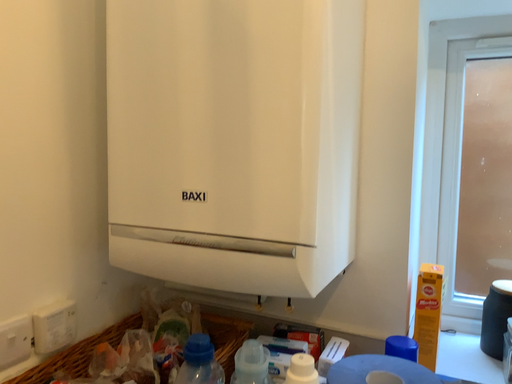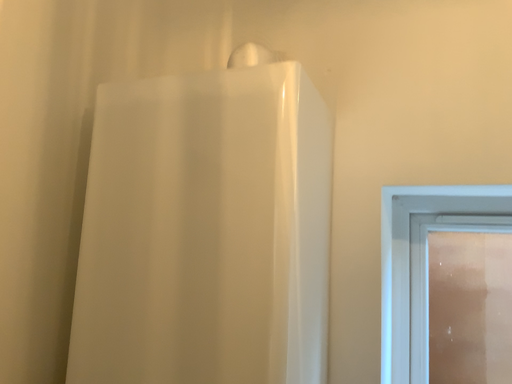
Question: How did the camera likely rotate when shooting the video?

Choices:
 (A) rotated upward
 (B) rotated downward

Answer: (A)